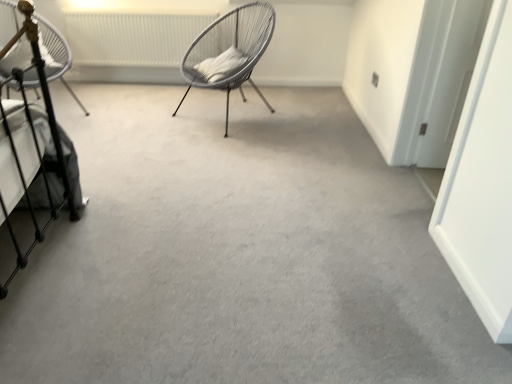
Image resolution: width=512 pixels, height=384 pixels. I want to click on free space above white textured radiator at upper center (from a real-world perspective), so click(x=131, y=0).